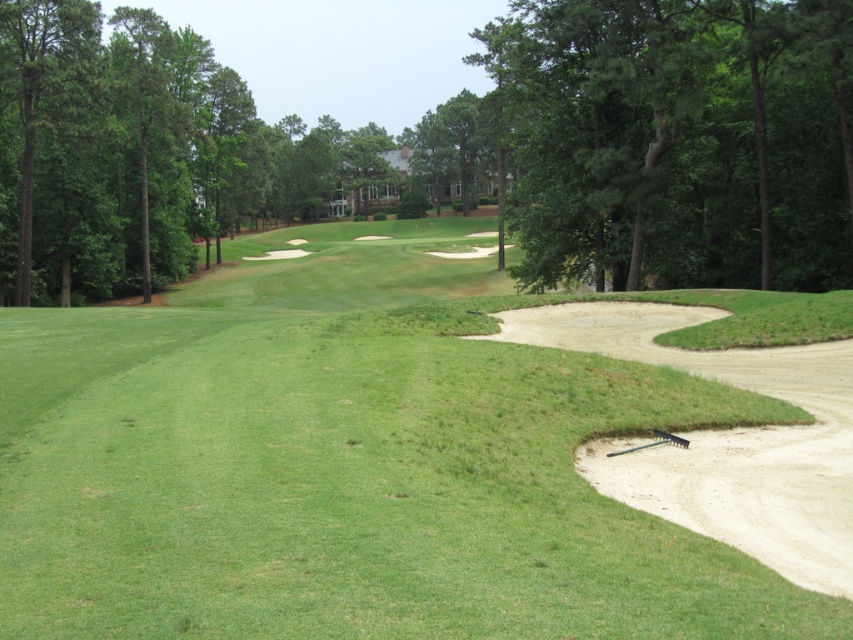
Question: From the image, what is the correct spatial relationship of green leafy tree at center in relation to green leafy tree at upper center?

Choices:
 (A) left
 (B) right

Answer: (A)

Question: Which point appears farthest from the camera in this image?

Choices:
 (A) (637, 4)
 (B) (155, 570)

Answer: (A)

Question: Can you confirm if green grassy golf course at center is positioned above green leafy tree at center?

Choices:
 (A) yes
 (B) no

Answer: (B)

Question: Which point is closer to the camera taking this photo?

Choices:
 (A) (518, 196)
 (B) (178, 97)
 (C) (218, 589)

Answer: (C)

Question: Estimate the real-world distances between objects in this image. Which object is closer to the green leafy tree at center?

Choices:
 (A) green grassy golf course at center
 (B) green leafy tree at upper center

Answer: (B)

Question: Can you confirm if green grassy golf course at center is thinner than green leafy tree at upper center?

Choices:
 (A) yes
 (B) no

Answer: (B)